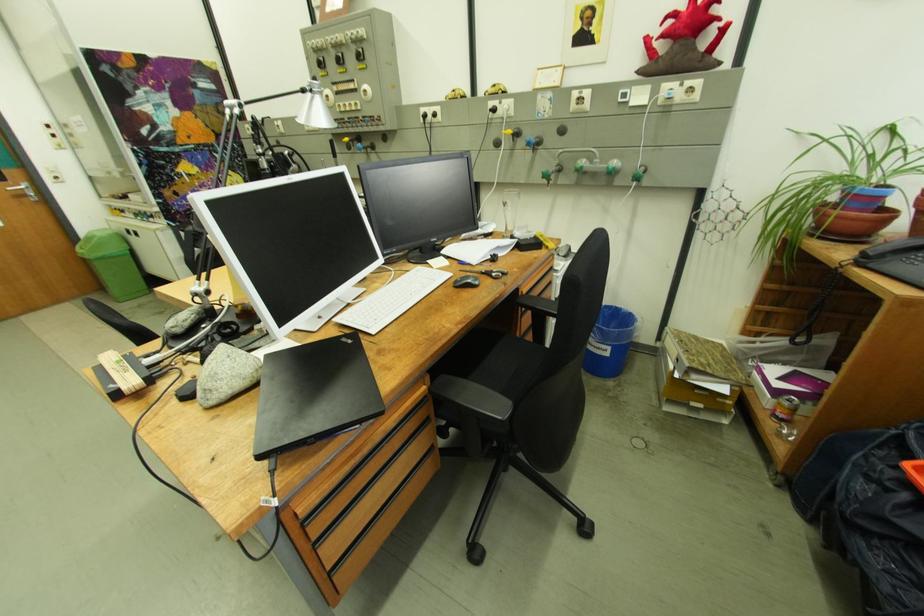
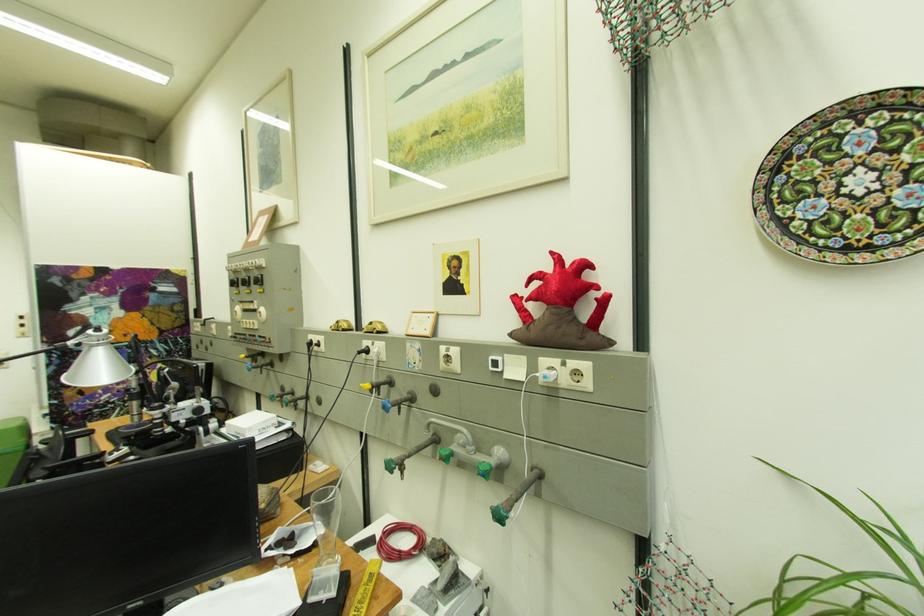
Find the pixel in the second image that matches (x=502, y=103) in the first image.

(375, 344)